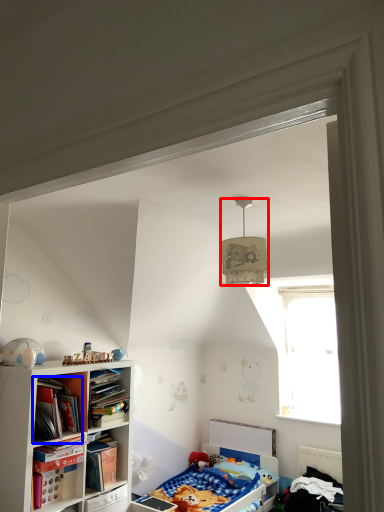
Question: Which object is closer to the camera taking this photo, lamp (highlighted by a red box) or book (highlighted by a blue box)?

Choices:
 (A) lamp
 (B) book

Answer: (A)